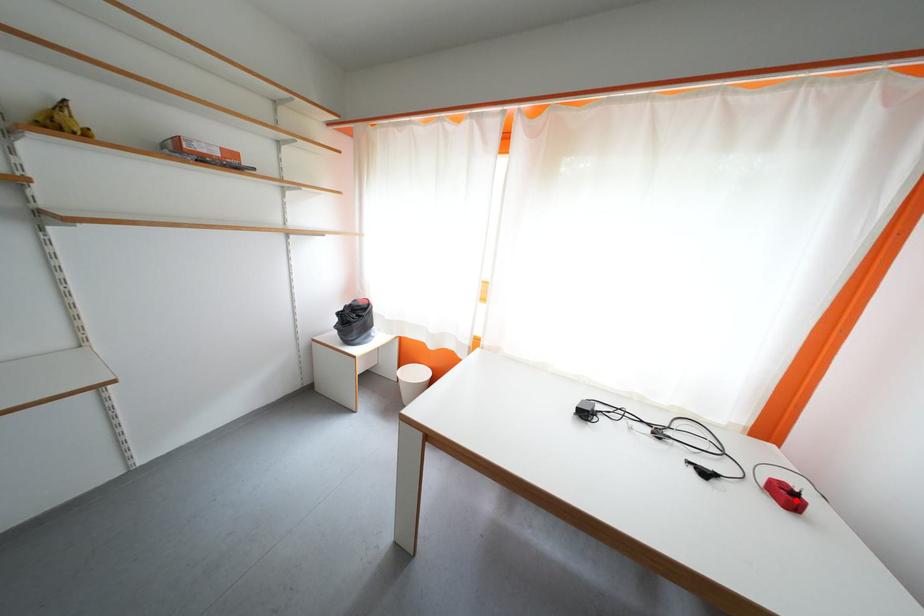
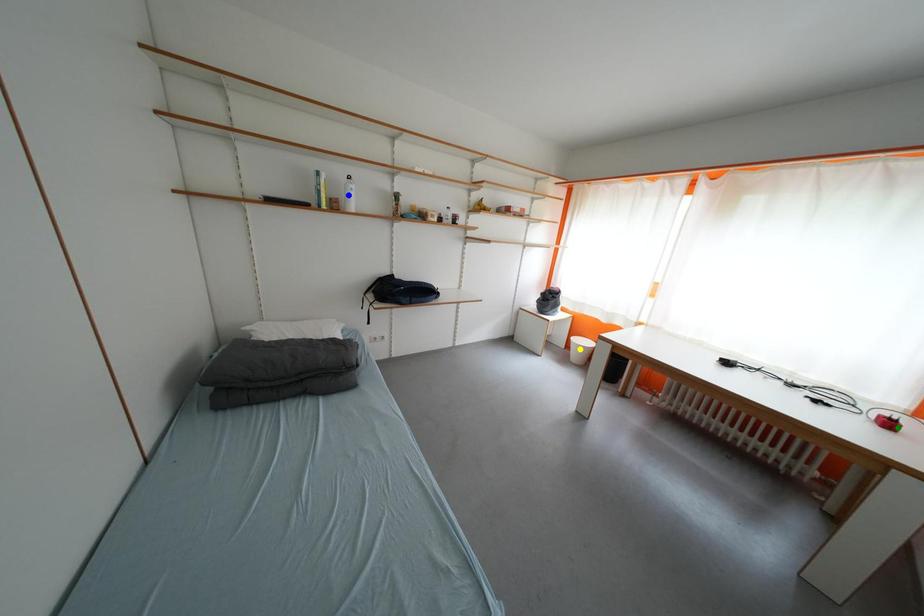
Question: I am providing you with two images of the same scene from different viewpoints. A red point is marked on the first image. You are given multiple points on the second image. Which point in image 2 is actually the same real-world point as the red point in image 1?

Choices:
 (A) blue point
 (B) green point
 (C) yellow point

Answer: (B)